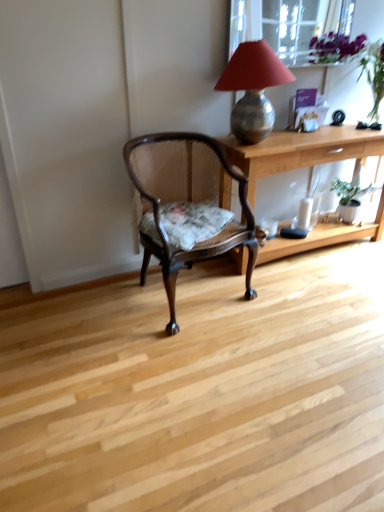
Question: Is mahogany cane chair at center completely or partially outside of transparent glass window screen at upper center?

Choices:
 (A) yes
 (B) no

Answer: (A)

Question: Does mahogany cane chair at center have a greater height compared to transparent glass window screen at upper center?

Choices:
 (A) no
 (B) yes

Answer: (B)

Question: From the image's perspective, would you say mahogany cane chair at center is shown under transparent glass window screen at upper center?

Choices:
 (A) no
 (B) yes

Answer: (B)

Question: From the image's perspective, is mahogany cane chair at center over transparent glass window screen at upper center?

Choices:
 (A) no
 (B) yes

Answer: (A)

Question: Could you tell me if mahogany cane chair at center is turned towards transparent glass window screen at upper center?

Choices:
 (A) no
 (B) yes

Answer: (A)

Question: Relative to light wood desk at center, is green matte houseplant at right in front or behind?

Choices:
 (A) behind
 (B) front

Answer: (A)

Question: From the image's perspective, relative to light wood desk at center, is green matte houseplant at right above or below?

Choices:
 (A) below
 (B) above

Answer: (A)

Question: In terms of height, does green matte houseplant at right look taller or shorter compared to light wood desk at center?

Choices:
 (A) short
 (B) tall

Answer: (A)

Question: Considering the positions of green matte houseplant at right and light wood desk at center in the image, is green matte houseplant at right wider or thinner than light wood desk at center?

Choices:
 (A) wide
 (B) thin

Answer: (B)

Question: From the image's perspective, is mahogany cane chair at center positioned above or below transparent glass window screen at upper center?

Choices:
 (A) below
 (B) above

Answer: (A)

Question: In the image, is mahogany cane chair at center positioned in front of or behind transparent glass window screen at upper center?

Choices:
 (A) behind
 (B) front

Answer: (B)

Question: In terms of height, does mahogany cane chair at center look taller or shorter compared to transparent glass window screen at upper center?

Choices:
 (A) short
 (B) tall

Answer: (B)

Question: From a real-world perspective, is mahogany cane chair at center physically located above or below transparent glass window screen at upper center?

Choices:
 (A) above
 (B) below

Answer: (B)

Question: Choose the correct answer: Is transparent glass window screen at upper center inside light wood desk at center or outside it?

Choices:
 (A) inside
 (B) outside

Answer: (B)

Question: Based on their positions, is transparent glass window screen at upper center located to the left or right of light wood desk at center?

Choices:
 (A) left
 (B) right

Answer: (A)